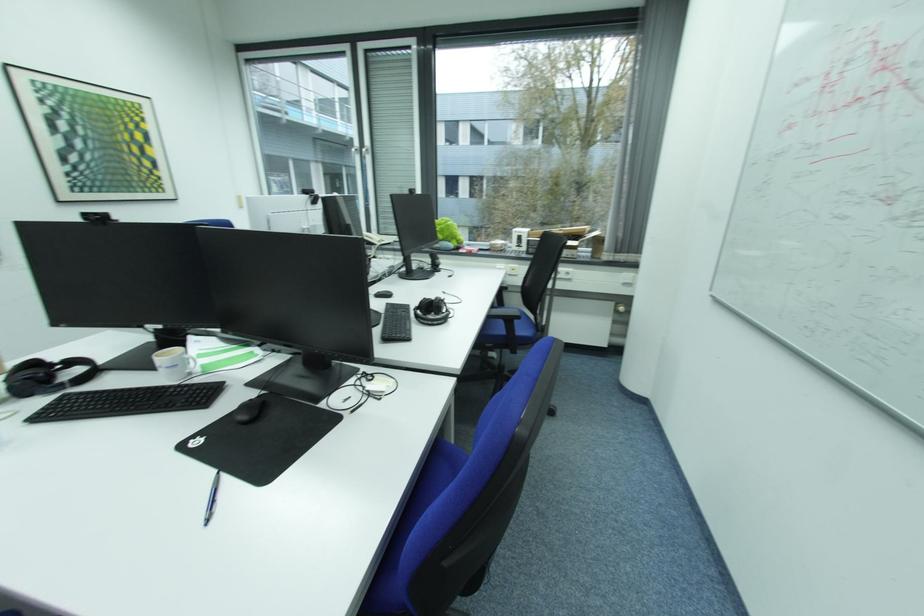
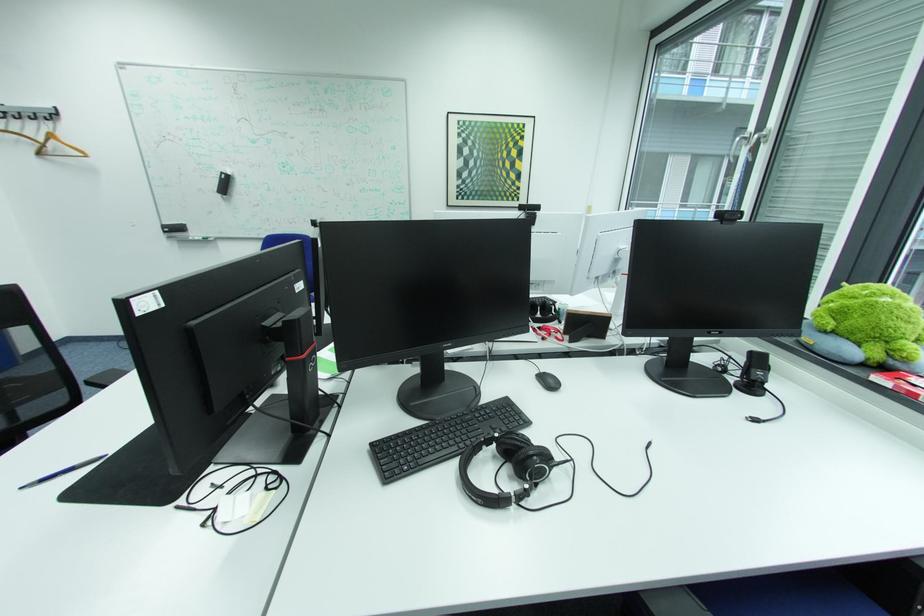
Where in the second image is the point corresponding to (453,322) from the first image?

(489, 501)